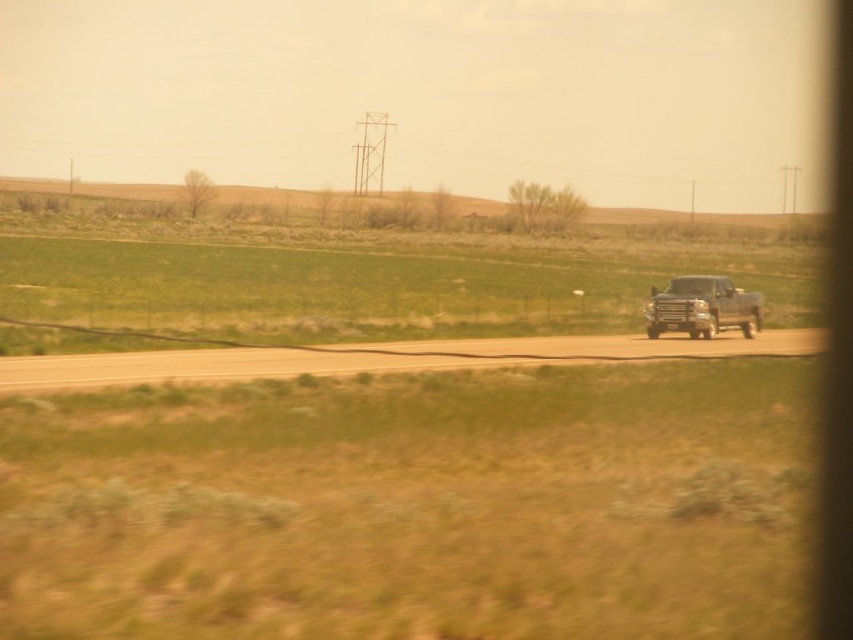
Question: Does smooth asphalt highway at center have a lesser width compared to metallic silver truck at right?

Choices:
 (A) no
 (B) yes

Answer: (A)

Question: Can you confirm if smooth asphalt highway at center is positioned above metallic silver truck at right?

Choices:
 (A) yes
 (B) no

Answer: (B)

Question: Observing the image, what is the correct spatial positioning of smooth asphalt highway at center in reference to metallic silver truck at right?

Choices:
 (A) above
 (B) below

Answer: (B)

Question: Which point is closer to the camera?

Choices:
 (A) (230, 355)
 (B) (688, 284)

Answer: (A)

Question: Which object appears closest to the camera in this image?

Choices:
 (A) metallic silver truck at right
 (B) smooth asphalt highway at center

Answer: (B)